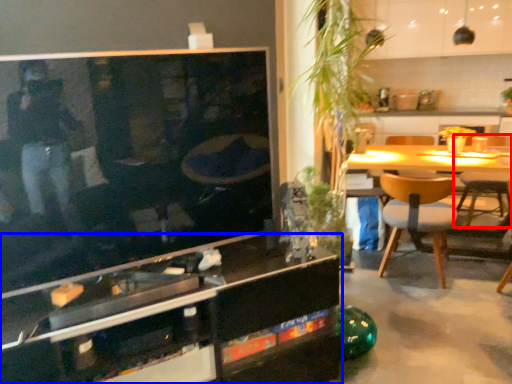
Question: Which object is further to the camera taking this photo, chair (highlighted by a red box) or cabinetry (highlighted by a blue box)?

Choices:
 (A) chair
 (B) cabinetry

Answer: (A)